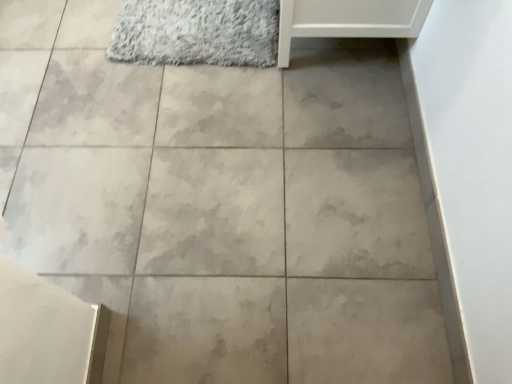
The height and width of the screenshot is (384, 512). What do you see at coordinates (196, 32) in the screenshot?
I see `white shaggy bath mat at upper left` at bounding box center [196, 32].

Where is `white shaggy bath mat at upper left`? This screenshot has width=512, height=384. white shaggy bath mat at upper left is located at coordinates (196, 32).

This screenshot has height=384, width=512. I want to click on white shaggy bath mat at upper left, so click(196, 32).